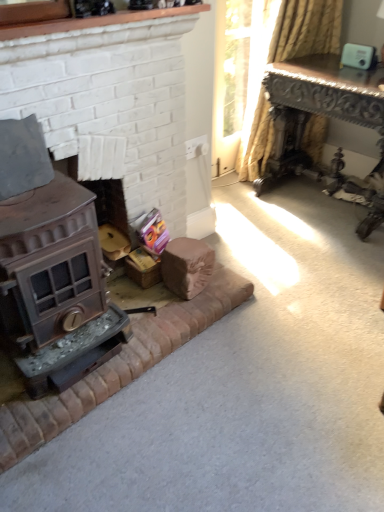
Question: From the image's perspective, would you say dark brown polished wood table at upper right is positioned over yellow striped fabric at upper right?

Choices:
 (A) yes
 (B) no

Answer: (B)

Question: From a real-world perspective, is dark brown polished wood table at upper right beneath yellow striped fabric at upper right?

Choices:
 (A) yes
 (B) no

Answer: (A)

Question: Considering the relative sizes of dark brown polished wood table at upper right and yellow striped fabric at upper right in the image provided, is dark brown polished wood table at upper right wider than yellow striped fabric at upper right?

Choices:
 (A) yes
 (B) no

Answer: (A)

Question: Considering the relative sizes of dark brown polished wood table at upper right and yellow striped fabric at upper right in the image provided, is dark brown polished wood table at upper right smaller than yellow striped fabric at upper right?

Choices:
 (A) yes
 (B) no

Answer: (B)

Question: Could you tell me if dark brown polished wood table at upper right is facing yellow striped fabric at upper right?

Choices:
 (A) no
 (B) yes

Answer: (A)

Question: Considering the relative sizes of dark brown polished wood table at upper right and yellow striped fabric at upper right in the image provided, is dark brown polished wood table at upper right thinner than yellow striped fabric at upper right?

Choices:
 (A) no
 (B) yes

Answer: (A)

Question: Considering the relative sizes of bronze metallic wood burning stove at lower left and dark brown polished wood table at upper right in the image provided, is bronze metallic wood burning stove at lower left bigger than dark brown polished wood table at upper right?

Choices:
 (A) no
 (B) yes

Answer: (A)

Question: From the image's perspective, is bronze metallic wood burning stove at lower left under dark brown polished wood table at upper right?

Choices:
 (A) no
 (B) yes

Answer: (B)

Question: From a real-world perspective, does bronze metallic wood burning stove at lower left sit lower than dark brown polished wood table at upper right?

Choices:
 (A) no
 (B) yes

Answer: (B)

Question: Is bronze metallic wood burning stove at lower left facing towards dark brown polished wood table at upper right?

Choices:
 (A) yes
 (B) no

Answer: (B)

Question: Can you confirm if bronze metallic wood burning stove at lower left is smaller than dark brown polished wood table at upper right?

Choices:
 (A) yes
 (B) no

Answer: (A)

Question: Can you see bronze metallic wood burning stove at lower left touching dark brown polished wood table at upper right?

Choices:
 (A) no
 (B) yes

Answer: (A)

Question: From a real-world perspective, is matte brown wood stove at left, which is the 1th fireplace in top-to-bottom order, positioned over yellow striped fabric at upper right based on gravity?

Choices:
 (A) yes
 (B) no

Answer: (B)